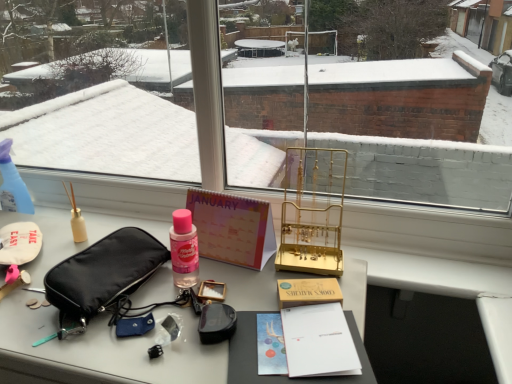
The width and height of the screenshot is (512, 384). I want to click on free point in front of black fabric pouch at left, so click(97, 332).